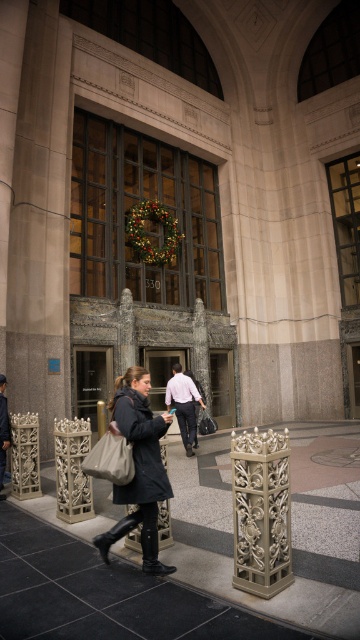
Question: Which of these objects is positioned closest to the dark gray wool coat at center?

Choices:
 (A) light brown leather jacket at center
 (B) carved stone column at center
 (C) light brown leather jacket at lower left

Answer: (B)

Question: Can you confirm if dark gray wool coat at center is positioned to the left of light brown leather jacket at center?

Choices:
 (A) no
 (B) yes

Answer: (B)

Question: Is carved stone column at center smaller than dark gray wool coat at center?

Choices:
 (A) yes
 (B) no

Answer: (A)

Question: Does carved stone column at center appear on the left side of light brown leather jacket at center?

Choices:
 (A) no
 (B) yes

Answer: (A)

Question: Among these objects, which one is nearest to the camera?

Choices:
 (A) carved stone column at center
 (B) dark gray wool coat at center

Answer: (A)

Question: Which point appears farthest from the camera in this image?

Choices:
 (A) (258, 524)
 (B) (146, 390)
 (C) (6, 381)

Answer: (C)